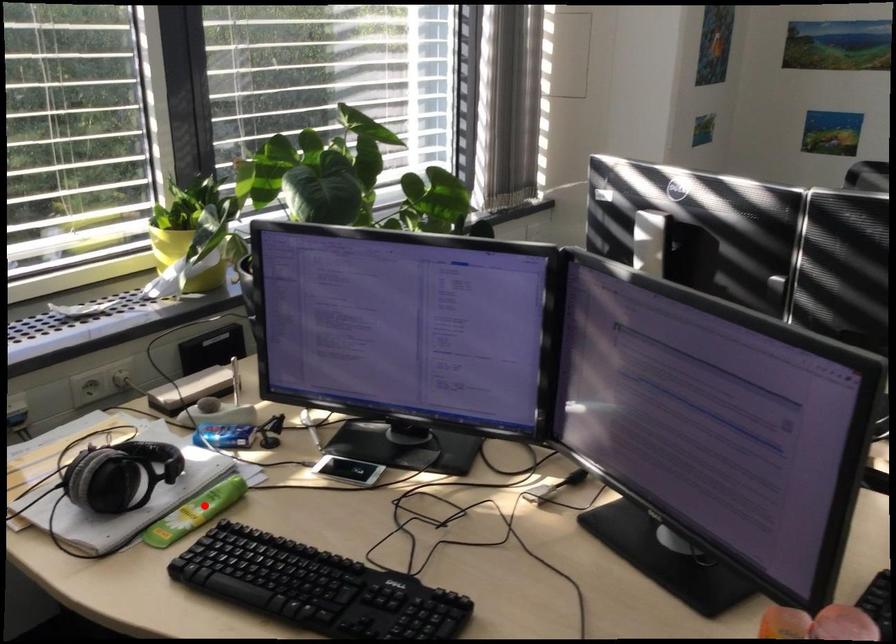
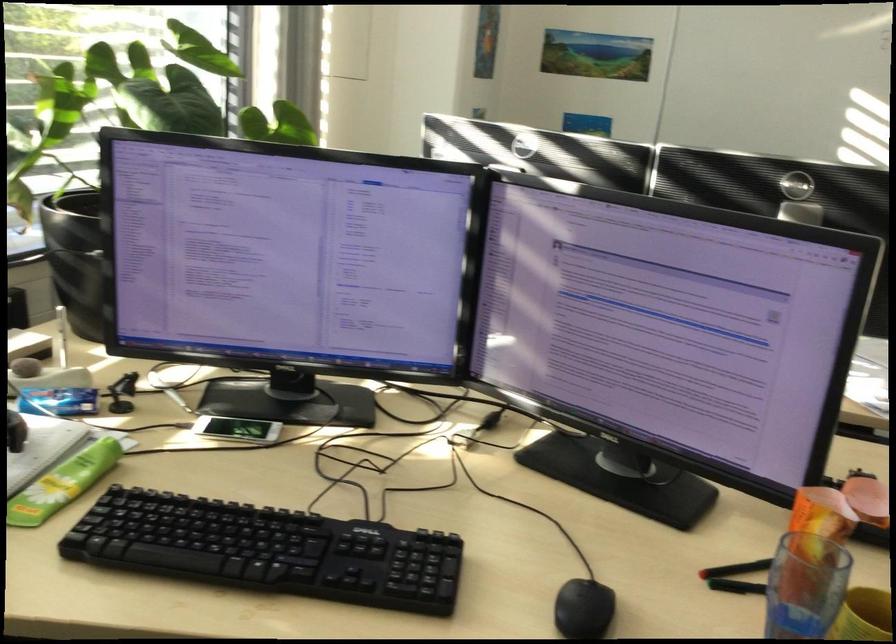
Question: A red point is marked in image1. In image2, is the corresponding 3D point closer to the camera or farther? Reply with the corresponding letter.

Choices:
 (A) The corresponding 3D point is closer.
 (B) The corresponding 3D point is farther.

Answer: (A)